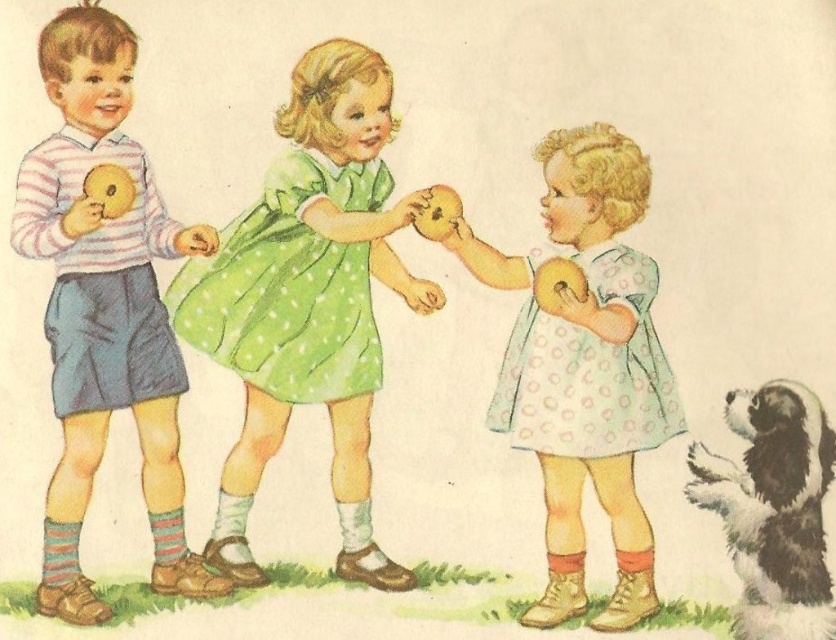
Question: Is matte striped sweater at left positioned before pastel dotted dress at center?

Choices:
 (A) yes
 (B) no

Answer: (A)

Question: Can you confirm if pastel dotted dress at center is positioned to the left of black and white fur dog at lower right?

Choices:
 (A) yes
 (B) no

Answer: (A)

Question: Which is nearer to the matte yellow plush toy at center?

Choices:
 (A) matte striped sweater at left
 (B) black and white fur dog at lower right

Answer: (A)

Question: Which point is closer to the camera?

Choices:
 (A) green polka dot dress at center
 (B) matte yellow doll at left
 (C) matte yellow plush toy at center
 (D) pastel dotted dress at center

Answer: (D)

Question: Is pastel dotted dress at center wider than black and white fur dog at lower right?

Choices:
 (A) yes
 (B) no

Answer: (A)

Question: Which point is closer to the camera?

Choices:
 (A) matte yellow doll at left
 (B) matte yellow plush toy at center

Answer: (A)